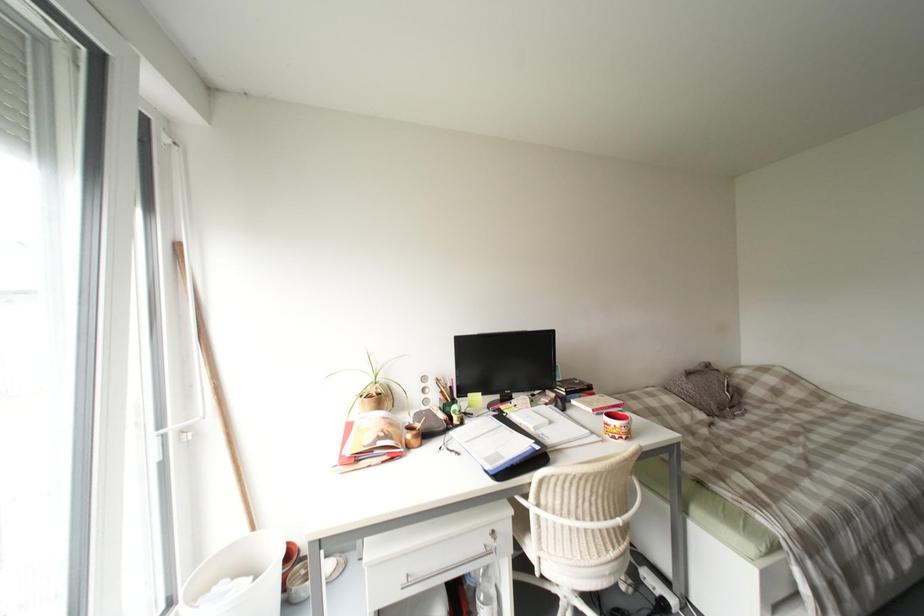
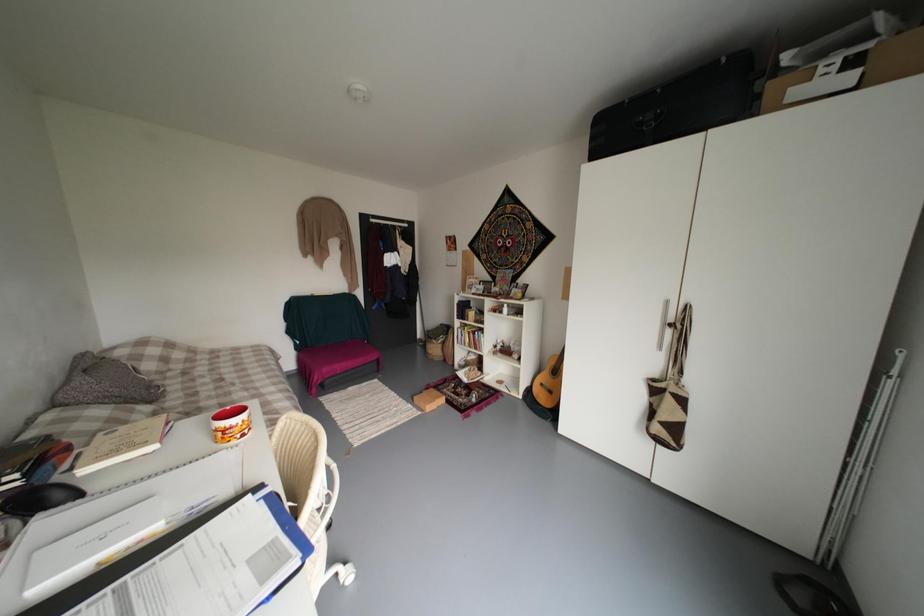
Question: The camera is either moving clockwise (left) or counter-clockwise (right) around the object. The first image is from the beginning of the video and the second image is from the end. Is the camera moving left or right when shooting the video?

Choices:
 (A) Left
 (B) Right

Answer: (A)